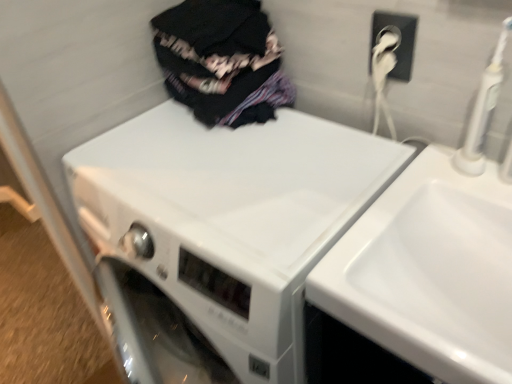
Question: Is white glossy sink at upper right located within white glossy washing machine at center?

Choices:
 (A) no
 (B) yes

Answer: (A)

Question: Is white glossy washing machine at center facing towards white glossy sink at upper right?

Choices:
 (A) yes
 (B) no

Answer: (B)

Question: From a real-world perspective, is white glossy washing machine at center located beneath white glossy sink at upper right?

Choices:
 (A) no
 (B) yes

Answer: (B)

Question: Is white glossy washing machine at center placed right next to white glossy sink at upper right?

Choices:
 (A) no
 (B) yes

Answer: (A)

Question: From a real-world perspective, is white glossy washing machine at center on white glossy sink at upper right?

Choices:
 (A) no
 (B) yes

Answer: (A)

Question: Is white glossy washing machine at center in front of white glossy sink at upper right?

Choices:
 (A) yes
 (B) no

Answer: (B)

Question: From the image's perspective, is white glossy sink at upper right located beneath dark fabric clothes at upper center?

Choices:
 (A) yes
 (B) no

Answer: (A)

Question: Considering the relative positions of white glossy sink at upper right and dark fabric clothes at upper center in the image provided, is white glossy sink at upper right to the right of dark fabric clothes at upper center from the viewer's perspective?

Choices:
 (A) no
 (B) yes

Answer: (B)

Question: Is white glossy sink at upper right aimed at dark fabric clothes at upper center?

Choices:
 (A) no
 (B) yes

Answer: (A)

Question: From a real-world perspective, is white glossy sink at upper right physically above dark fabric clothes at upper center?

Choices:
 (A) no
 (B) yes

Answer: (A)

Question: Can dark fabric clothes at upper center be found inside white glossy sink at upper right?

Choices:
 (A) yes
 (B) no

Answer: (B)

Question: Is white glossy sink at upper right thinner than dark fabric clothes at upper center?

Choices:
 (A) yes
 (B) no

Answer: (B)

Question: Considering the relative sizes of white glossy sink at upper right and white glossy washing machine at center in the image provided, is white glossy sink at upper right shorter than white glossy washing machine at center?

Choices:
 (A) yes
 (B) no

Answer: (A)